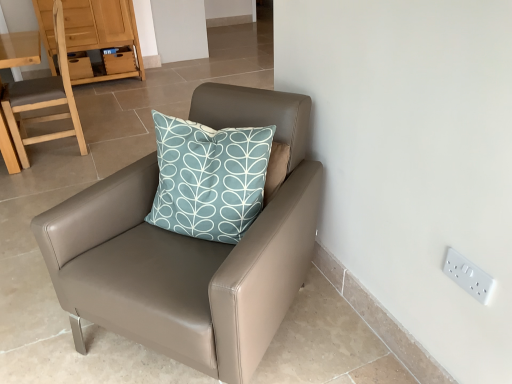
Question: From a real-world perspective, is matte wood dresser at upper left located higher than matte leather chair at center, the 1th chair from the front?

Choices:
 (A) yes
 (B) no

Answer: (A)

Question: From the image's perspective, is matte wood dresser at upper left on matte leather chair at center, the 1th chair positioned from the right?

Choices:
 (A) no
 (B) yes

Answer: (B)

Question: Considering the relative positions of matte wood dresser at upper left and matte leather chair at center, which is the 2th chair from left to right, in the image provided, is matte wood dresser at upper left to the right of matte leather chair at center, which is the 2th chair from left to right, from the viewer's perspective?

Choices:
 (A) no
 (B) yes

Answer: (A)

Question: Is there a large distance between matte wood dresser at upper left and matte leather chair at center, which is the 2th chair from left to right?

Choices:
 (A) yes
 (B) no

Answer: (A)

Question: Is matte wood dresser at upper left to the left of matte leather chair at center, the 1th chair positioned from the right, from the viewer's perspective?

Choices:
 (A) yes
 (B) no

Answer: (A)

Question: From the image's perspective, would you say matte wood dresser at upper left is shown under matte leather chair at center, which is the 2th chair from left to right?

Choices:
 (A) yes
 (B) no

Answer: (B)

Question: Is light brown wooden chair at left, arranged as the 1th chair when viewed from the left, positioned before white plastic electric outlet at upper right?

Choices:
 (A) yes
 (B) no

Answer: (B)

Question: Is light brown wooden chair at left, which is the second chair in front-to-back order, turned away from white plastic electric outlet at upper right?

Choices:
 (A) yes
 (B) no

Answer: (B)

Question: From the image's perspective, is light brown wooden chair at left, which is counted as the first chair, starting from the back, on top of white plastic electric outlet at upper right?

Choices:
 (A) no
 (B) yes

Answer: (B)

Question: From a real-world perspective, is light brown wooden chair at left, which is the second chair in front-to-back order, on top of white plastic electric outlet at upper right?

Choices:
 (A) no
 (B) yes

Answer: (B)

Question: Does light brown wooden chair at left, which is the second chair in front-to-back order, have a lesser width compared to white plastic electric outlet at upper right?

Choices:
 (A) no
 (B) yes

Answer: (A)

Question: Can you confirm if light brown wooden chair at left, which ranks as the second chair in right-to-left order, is smaller than white plastic electric outlet at upper right?

Choices:
 (A) no
 (B) yes

Answer: (A)

Question: Is light brown wooden chair at left, arranged as the 1th chair when viewed from the left, placed right next to matte leather chair at center, which appears as the second chair when viewed from the back?

Choices:
 (A) yes
 (B) no

Answer: (B)